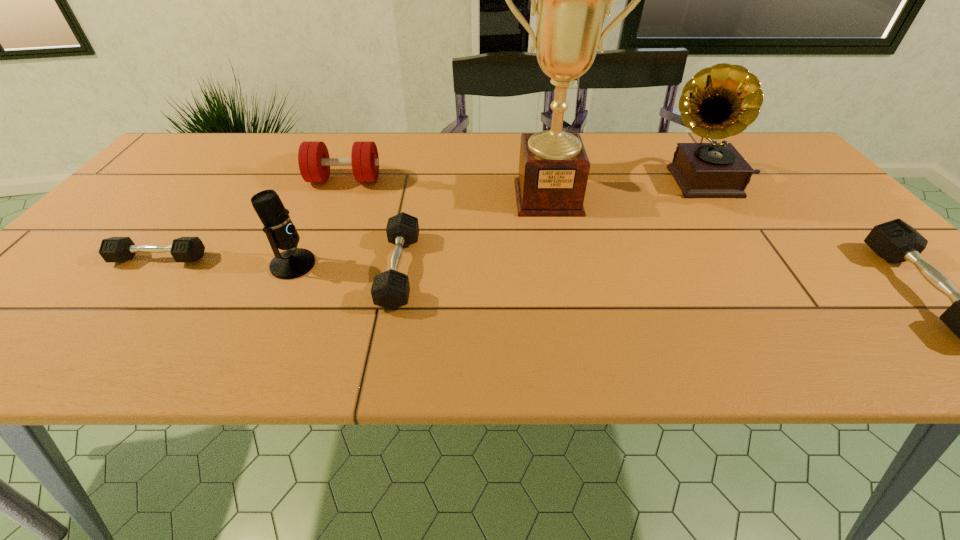
The height and width of the screenshot is (540, 960). Find the location of `dumbbell that is at the far edge`. dumbbell that is at the far edge is located at coordinates (314, 162).

Find the location of a particular element. object present at the near edge is located at coordinates (390, 289).

Where is `object that is at the left edge`? object that is at the left edge is located at coordinates pos(115,249).

This screenshot has width=960, height=540. Identify the location of object positioned at the right edge. (720, 101).

Image resolution: width=960 pixels, height=540 pixels. In order to click on object present at the far right corner in this screenshot , I will do `click(720, 101)`.

In the image, there is a desktop. Identify the location of vacant space at the far edge. The image size is (960, 540). (483, 157).

Find the location of `free spot at the left edge of the desktop`. free spot at the left edge of the desktop is located at coordinates (58, 287).

This screenshot has width=960, height=540. In the image, there is a desktop. In order to click on vacant space at the right edge in this screenshot , I will do `click(764, 177)`.

The image size is (960, 540). In the image, there is a desktop. What are the coordinates of `free space at the far right corner` in the screenshot? It's located at (797, 163).

Where is `vacant area at the near right corner`? This screenshot has height=540, width=960. vacant area at the near right corner is located at coordinates (922, 319).